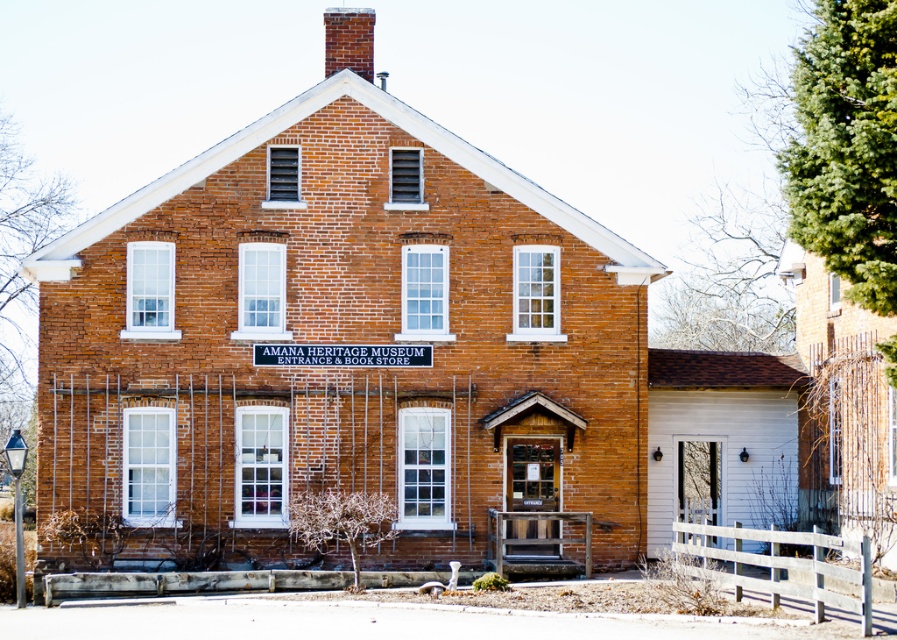
Between smooth brick chimney at center top and red brick chimney at upper center, which one has more height?

smooth brick chimney at center top is taller.

Is smooth brick chimney at center top below red brick chimney at upper center?

Indeed, smooth brick chimney at center top is positioned under red brick chimney at upper center.

Does point (315, 132) come closer to viewer compared to point (355, 36)?

Yes, point (315, 132) is in front of point (355, 36).

Where is `smooth brick chimney at center top`? The height and width of the screenshot is (640, 897). smooth brick chimney at center top is located at coordinates (345, 349).